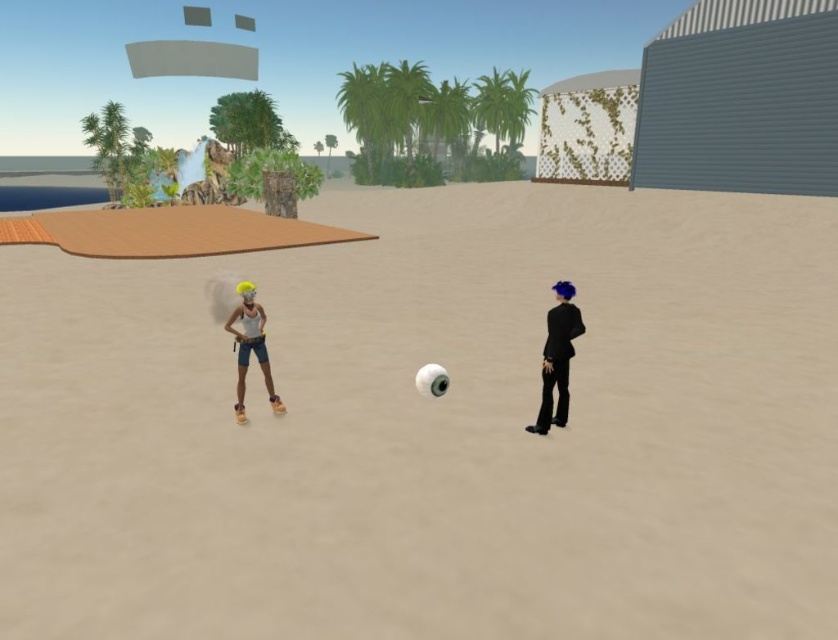
You are a character in the scene and want to place a small flag on the highest point between the beige sand at center and the shiny black suit at right. Which object should you choose to place the flag on?

The beige sand at center is much taller than the shiny black suit at right, so you should place the flag on the beige sand at center.

You are a character in the scene and want to step onto the beige sand at center without touching the matte yellow hair at center. Is this possible?

The beige sand at center is positioned over matte yellow hair at center, so stepping onto the beige sand at center would also mean stepping on the matte yellow hair at center. Therefore, it is not possible to step onto the beige sand at center without touching the matte yellow hair at center.

Consider the image. You are standing at the point marked as point (433, 428) in the image. What material are you standing on?

The beige sand at center is located at point (433, 428), so you are standing on beige sand.